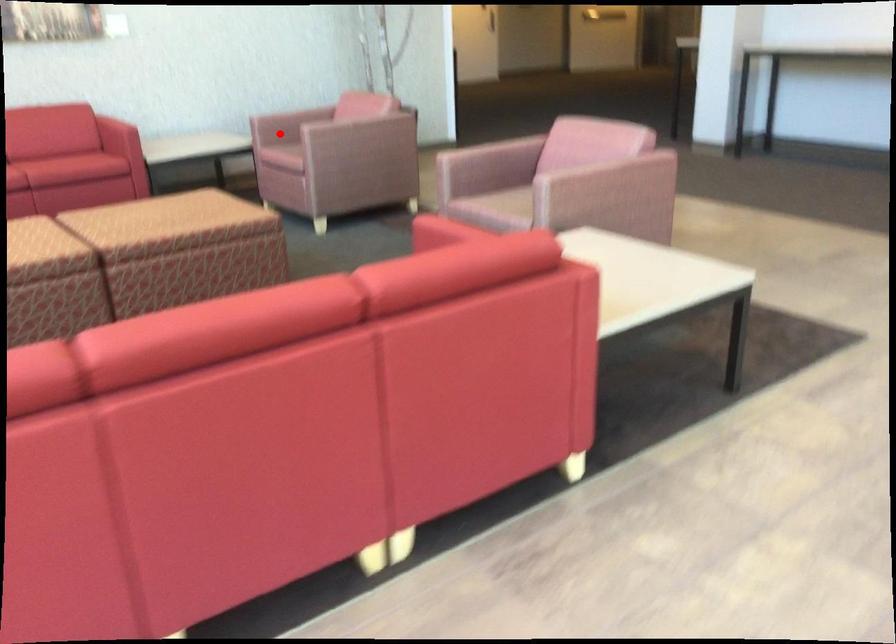
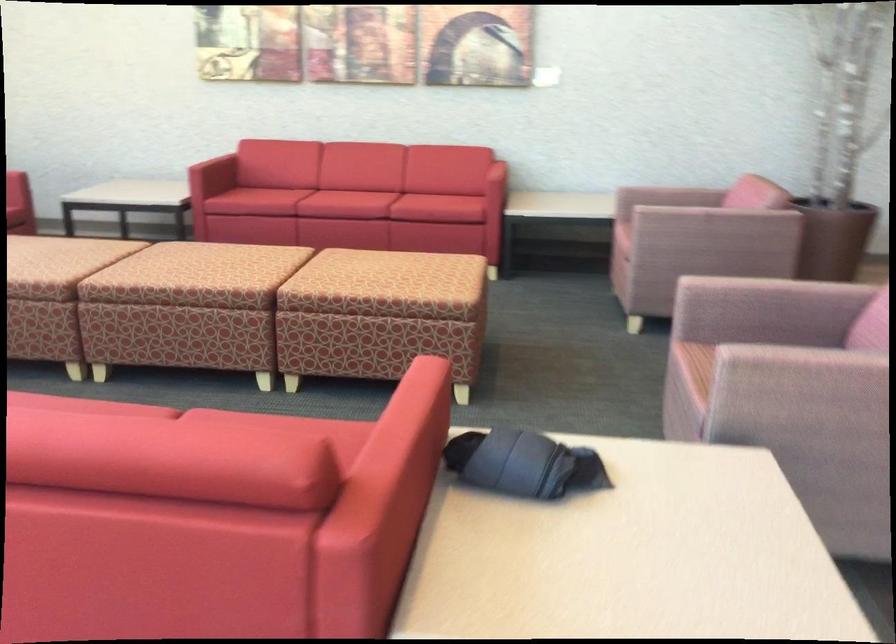
Question: A red point is marked in image1. In image2, is the corresponding 3D point closer to the camera or farther? Reply with the corresponding letter.

Choices:
 (A) The corresponding 3D point is closer.
 (B) The corresponding 3D point is farther.

Answer: (A)